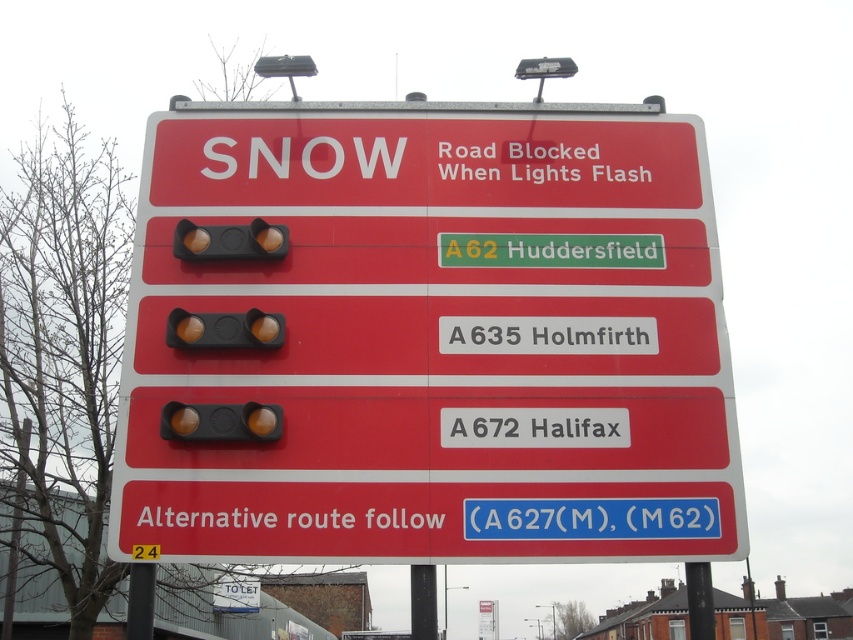
Between matte black traffic light at center and matte yellow traffic light at upper center, which one appears on the left side from the viewer's perspective?

From the viewer's perspective, matte yellow traffic light at upper center appears more on the left side.

Is matte black traffic light at center to the left of matte yellow traffic light at upper center from the viewer's perspective?

Incorrect, matte black traffic light at center is not on the left side of matte yellow traffic light at upper center.

Which is in front, point (271, 429) or point (189, 257)?

Point (271, 429) is more forward.

You are a GUI agent. You are given a task and a screenshot of the screen. Output one action in this format:
    pyautogui.click(x=<x>, y=<y>)
    Task: Click on the matte black traffic light at center
    The image size is (853, 640).
    Given the screenshot: What is the action you would take?
    pyautogui.click(x=219, y=420)

You are a GUI agent. You are given a task and a screenshot of the screen. Output one action in this format:
    pyautogui.click(x=<x>, y=<y>)
    Task: Click on the matte black traffic light at center
    This screenshot has width=853, height=640.
    Given the screenshot: What is the action you would take?
    pyautogui.click(x=219, y=420)

Locate an element on the screen. This screenshot has height=640, width=853. matte black traffic light at center is located at coordinates (219, 420).

Identify the location of matte black traffic light at center. (219, 420).

What do you see at coordinates (436, 344) in the screenshot? I see `red plastic sign at center` at bounding box center [436, 344].

Which is more to the left, red plastic sign at center or matte yellow traffic light at upper center?

matte yellow traffic light at upper center

Measure the distance between red plastic sign at center and camera.

red plastic sign at center is 2.40 meters from camera.

Locate an element on the screen. red plastic sign at center is located at coordinates (436, 344).